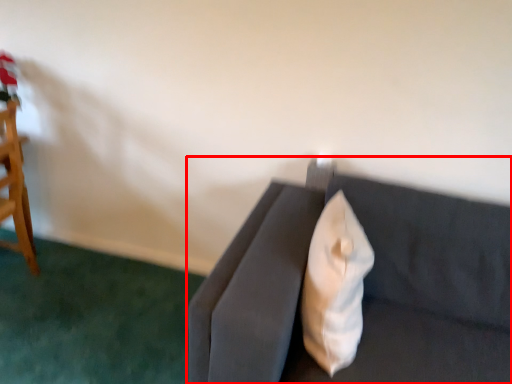
Question: Observing the image, what is the correct spatial positioning of studio couch (annotated by the red box) in reference to throw pillow?

Choices:
 (A) right
 (B) left

Answer: (A)